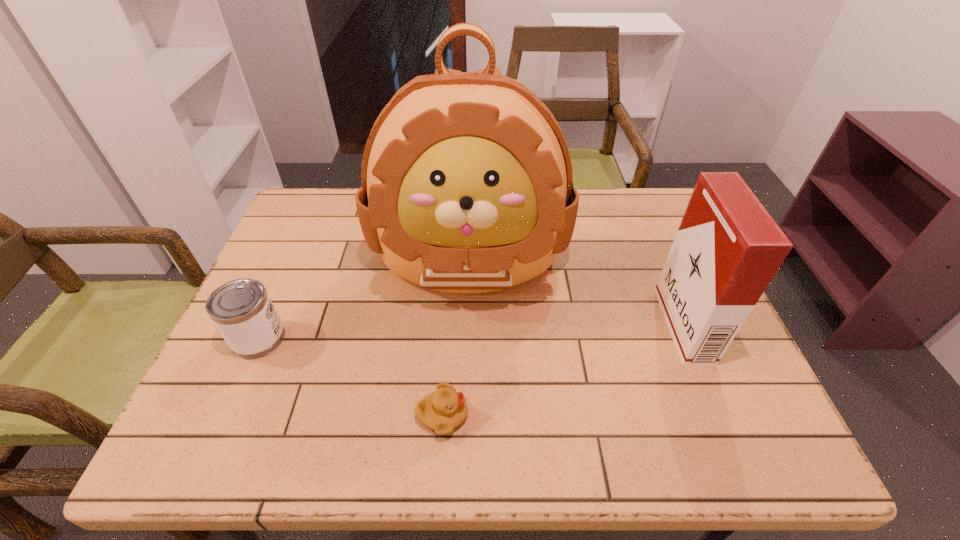
You are a GUI agent. You are given a task and a screenshot of the screen. Output one action in this format:
    pyautogui.click(x=<x>, y=<y>)
    Task: Click on the vacant position located on the front-facing side of the second tallest object
    This screenshot has width=960, height=540.
    Given the screenshot: What is the action you would take?
    pyautogui.click(x=599, y=326)

Identify the location of free location located on the back of the can. (310, 220).

At what (x,y) coordinates should I click in order to perform the action: click on vacant space located at the beak of the shortest object. Please return your answer as a coordinate pair (x, y). This screenshot has width=960, height=540. Looking at the image, I should click on (518, 416).

Image resolution: width=960 pixels, height=540 pixels. What are the coordinates of `object that is at the far edge` in the screenshot? It's located at [x=467, y=188].

Identify the location of object that is at the near edge. This screenshot has height=540, width=960. click(442, 411).

The image size is (960, 540). I want to click on object that is at the left edge, so click(x=242, y=311).

The width and height of the screenshot is (960, 540). What are the coordinates of `object that is at the right edge` in the screenshot? It's located at (727, 249).

In order to click on blank space at the near edge of the desktop in this screenshot , I will do `click(616, 441)`.

This screenshot has height=540, width=960. In order to click on vacant space at the left edge of the desktop in this screenshot , I will do `click(286, 287)`.

At what (x,y) coordinates should I click in order to perform the action: click on free location at the right edge of the desktop. Please return your answer as a coordinate pair (x, y). This screenshot has height=540, width=960. Looking at the image, I should click on (735, 374).